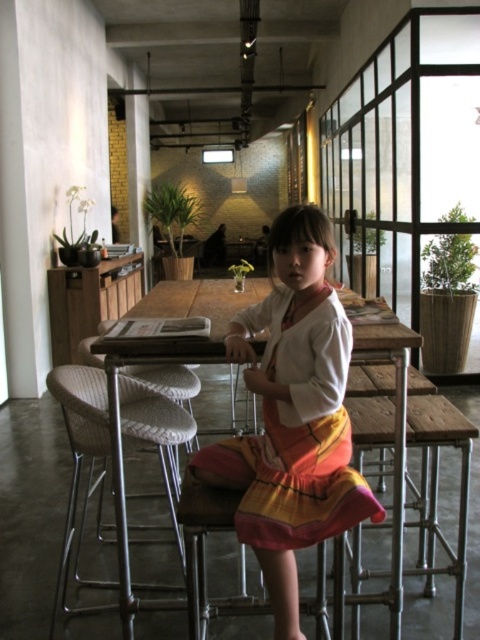
Between point (115, 365) and point (193, 445), which one is positioned in front?

Point (115, 365) is in front.

Who is higher up, wooden table at center or white fabric chair at center?

Positioned higher is wooden table at center.

Describe the element at coordinates (172, 340) in the screenshot. The height and width of the screenshot is (640, 480). I see `wooden table at center` at that location.

The image size is (480, 640). Find the location of `wooden table at center`. wooden table at center is located at coordinates (172, 340).

Does metallic silver bar stool at center appear over white fabric chair at center?

Actually, metallic silver bar stool at center is below white fabric chair at center.

Which is above, metallic silver bar stool at center or white fabric chair at center?

white fabric chair at center is higher up.

Is point (201, 598) positioned behind point (173, 385)?

No, it is not.

Image resolution: width=480 pixels, height=640 pixels. In order to click on metallic silver bar stool at center in this screenshot , I will do `click(204, 550)`.

Can you confirm if yellow-orange cotton dress at center is positioned to the left of metallic silver bar stool at center?

Incorrect, yellow-orange cotton dress at center is not on the left side of metallic silver bar stool at center.

Is yellow-orange cotton dress at center taller than metallic silver bar stool at center?

Yes, yellow-orange cotton dress at center is taller than metallic silver bar stool at center.

Is point (295, 442) positioned after point (181, 484)?

No, (295, 442) is closer to viewer.

Locate an element on the screen. The image size is (480, 640). yellow-orange cotton dress at center is located at coordinates (297, 435).